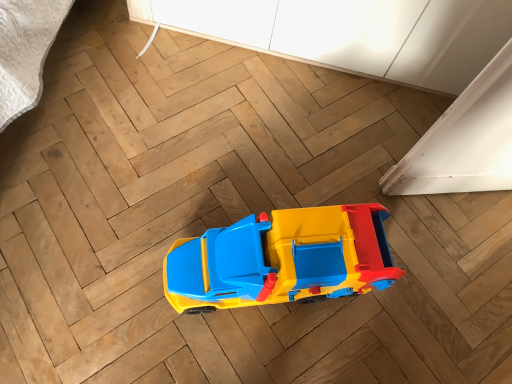
Identify the location of space that is in front of matte plastic toy car at center. Image resolution: width=512 pixels, height=384 pixels. (242, 349).